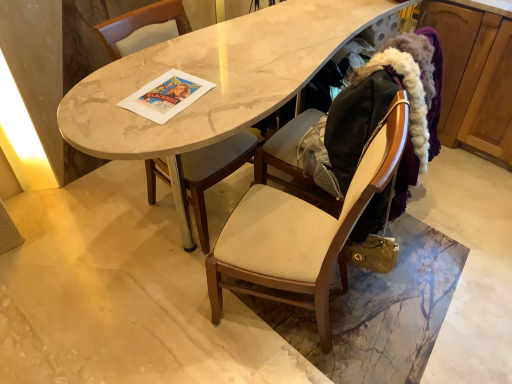
Identify the location of vacant location below beige fabric chair at center, the first chair in the right-to-left sequence (from a real-world perspective). (277, 318).